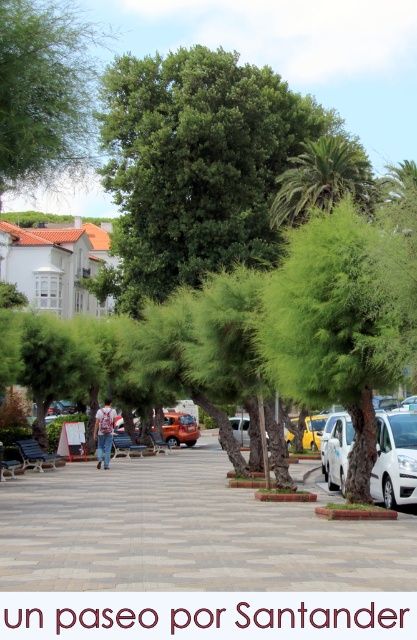
Where is `green leafy palm at upper center`? This screenshot has width=417, height=640. green leafy palm at upper center is located at coordinates (323, 179).

Is green leafy palm at upper center positioned behind white matte van at center-right?

Yes, it is.

Where is `green leafy palm at upper center`? This screenshot has width=417, height=640. green leafy palm at upper center is located at coordinates (323, 179).

Which of these two, white matte van at center-right or yellow matte car at center, stands shorter?

With less height is yellow matte car at center.

Which is in front, point (341, 424) or point (296, 424)?

Point (341, 424) is more forward.

In order to click on white matte van at center-right in this screenshot , I will do `click(394, 460)`.

Locate an element on the screen. This screenshot has height=640, width=417. white matte van at center-right is located at coordinates (394, 460).

Can you confirm if gray stone pavement at center is positioned above green fuzzy tree at center?

No, gray stone pavement at center is not above green fuzzy tree at center.

Does gray stone pavement at center have a lesser height compared to green fuzzy tree at center?

In fact, gray stone pavement at center may be taller than green fuzzy tree at center.

Is point (90, 538) closer to viewer compared to point (339, 228)?

Yes.

You are a GUI agent. You are given a task and a screenshot of the screen. Output one action in this format:
    pyautogui.click(x=<x>, y=<y>)
    Task: Click on the gray stone pavement at center
    The image size is (417, 640).
    Given the screenshot: What is the action you would take?
    pyautogui.click(x=185, y=532)